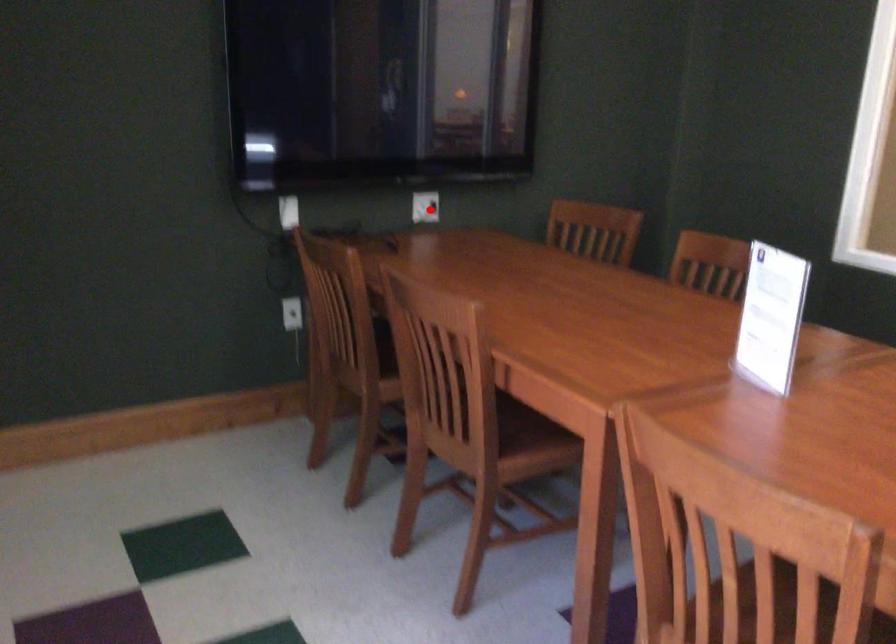
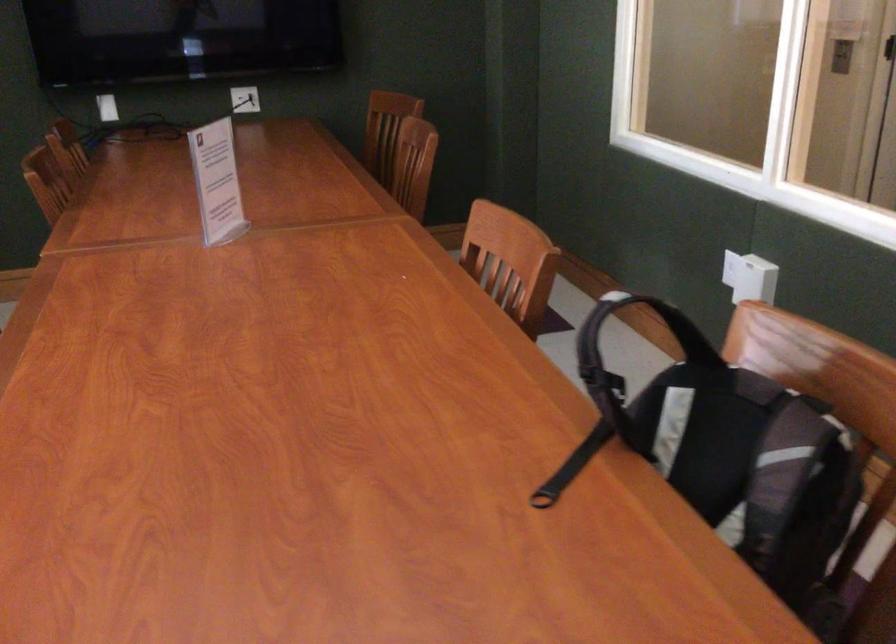
Question: I am providing you with two images of the same scene from different viewpoints. A red point is shown in image1. For the corresponding object point in image2, is it positioned nearer or farther from the camera?

Choices:
 (A) Nearer
 (B) Farther

Answer: (B)